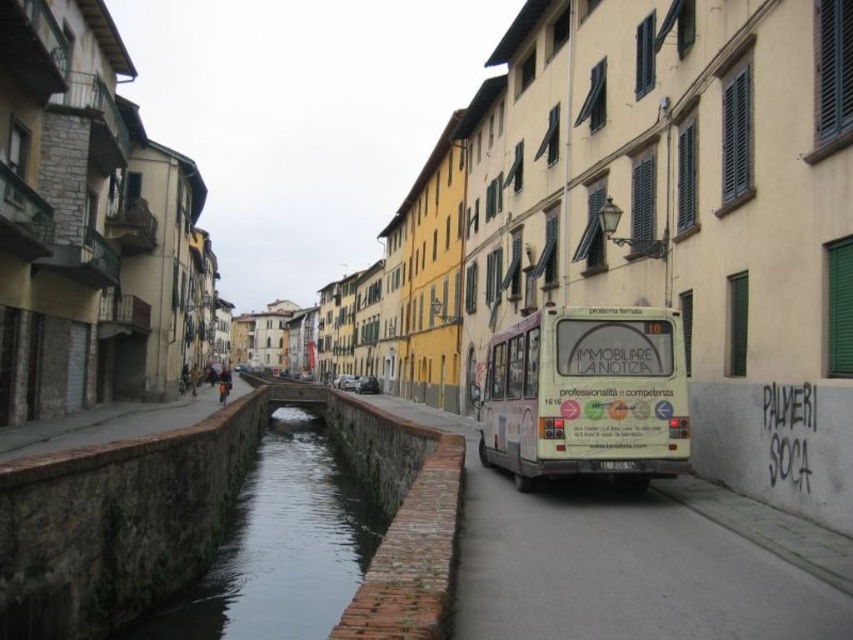
Question: Is white matte bus at center positioned before brick at lower center?

Choices:
 (A) yes
 (B) no

Answer: (B)

Question: Which point is closer to the camera taking this photo?

Choices:
 (A) (297, 595)
 (B) (378, 561)
 (C) (642, 340)

Answer: (B)

Question: Which object is closer to the camera taking this photo?

Choices:
 (A) dark gray concrete river at center
 (B) brick at lower center
 (C) white matte bus at center

Answer: (B)

Question: Is dark gray concrete river at center to the left of brick at lower center from the viewer's perspective?

Choices:
 (A) yes
 (B) no

Answer: (A)

Question: Which object appears closest to the camera in this image?

Choices:
 (A) dark gray concrete river at center
 (B) white matte bus at center
 (C) brick at lower center

Answer: (C)

Question: Does white matte bus at center have a smaller size compared to dark gray concrete river at center?

Choices:
 (A) no
 (B) yes

Answer: (B)